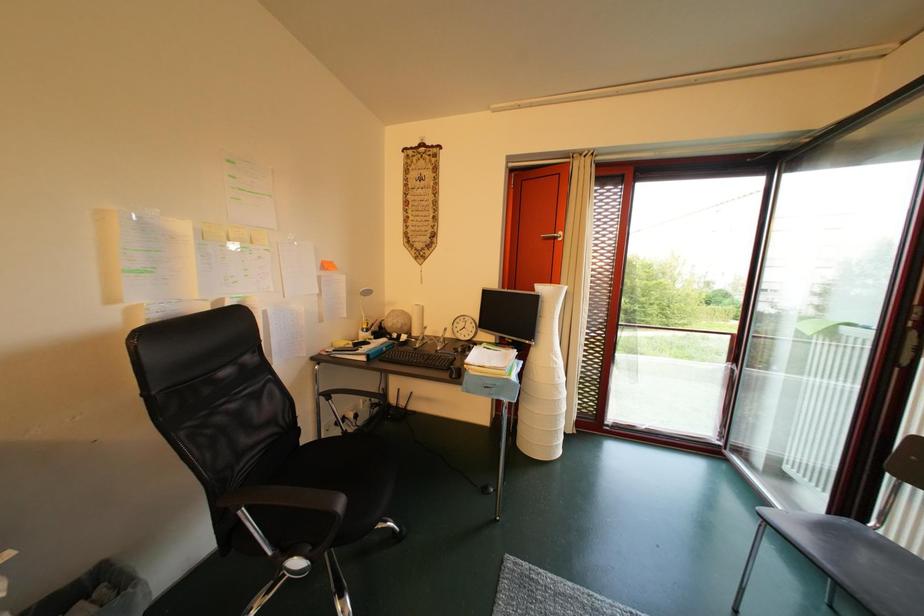
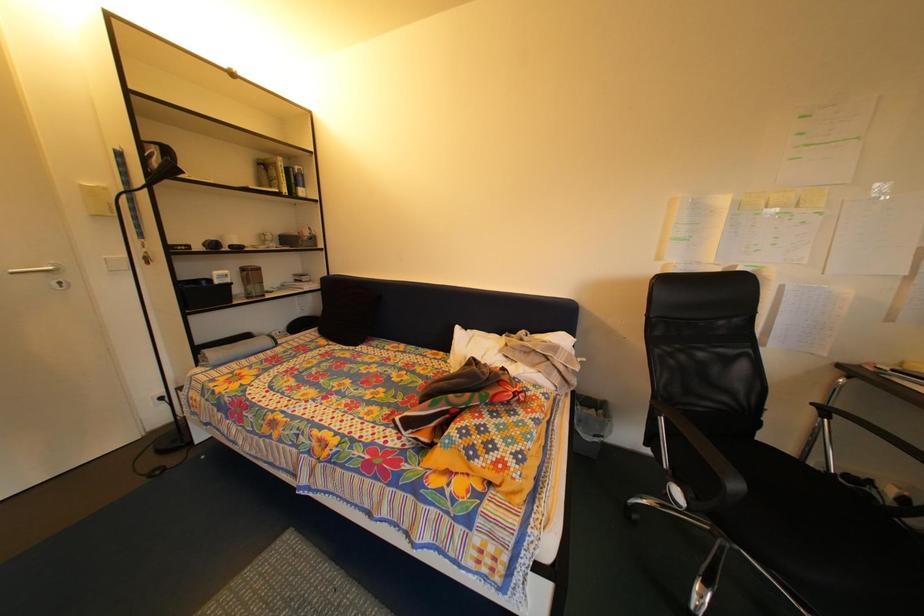
Question: The camera is either moving clockwise (left) or counter-clockwise (right) around the object. The first image is from the beginning of the video and the second image is from the end. Is the camera moving left or right when shooting the video?

Choices:
 (A) Left
 (B) Right

Answer: (B)